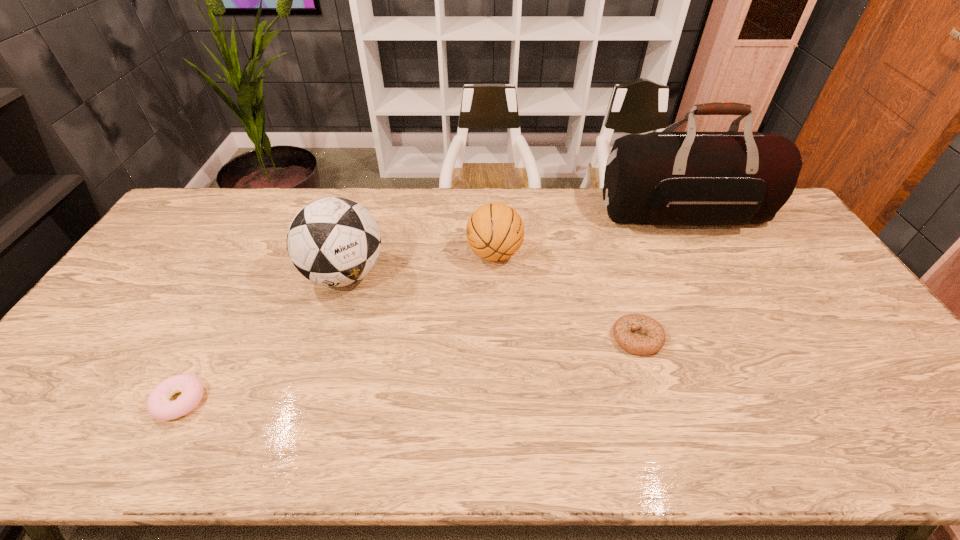
Where is `free spot between the nearest object and the third shortest object`? free spot between the nearest object and the third shortest object is located at coordinates (337, 327).

Locate an element on the screen. The height and width of the screenshot is (540, 960). free area in between the fourth shortest object and the bagel is located at coordinates (492, 306).

At what (x,y) coordinates should I click in order to perform the action: click on vacant space that's between the doughnut and the bagel. Please return your answer as a coordinate pair (x, y). This screenshot has height=540, width=960. Looking at the image, I should click on (409, 369).

You are a GUI agent. You are given a task and a screenshot of the screen. Output one action in this format:
    pyautogui.click(x=<x>, y=<y>)
    Task: Click on the free space between the duffel bag and the basketball
    This screenshot has width=960, height=540.
    Given the screenshot: What is the action you would take?
    coord(589,234)

Locate an element on the screen. free spot between the fourth object from right to left and the fourth farthest object is located at coordinates (492, 306).

This screenshot has height=540, width=960. I want to click on the fourth closest object to the duffel bag, so click(x=159, y=407).

Find the location of a particular element. The width and height of the screenshot is (960, 540). the second closest object to the fourth farthest object is located at coordinates (691, 178).

At what (x,y) coordinates should I click in order to perform the action: click on free point that satisfies the following two spatial constraints: 1. on the surface of the fourth farthest object where the brand logo is visible; 2. on the left side of the second tallest object. Please return your answer as a coordinate pair (x, y). This screenshot has height=540, width=960. Looking at the image, I should click on (325, 338).

Identify the location of vacant area in the image that satisfies the following two spatial constraints: 1. on the surface of the basketball near the brand logo; 2. on the front side of the nearest object. The width and height of the screenshot is (960, 540). (499, 401).

The image size is (960, 540). I want to click on free location that satisfies the following two spatial constraints: 1. on the surface of the third object from right to left near the brand logo; 2. on the front side of the leftmost object, so click(499, 401).